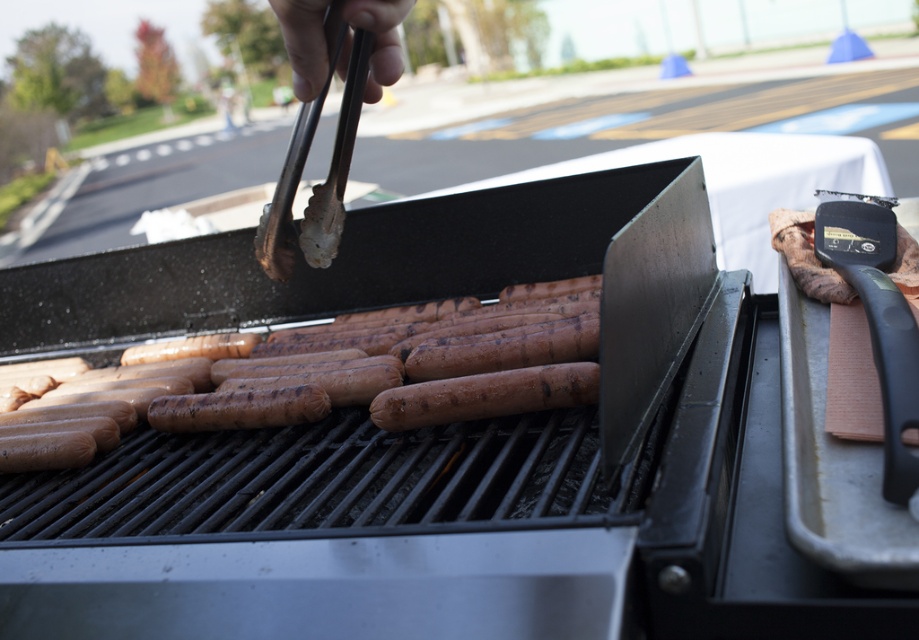
Question: Which object is the farthest from the brown matte hot dog at center?

Choices:
 (A) black plastic spatula at right
 (B) stainless steel tongs at upper center

Answer: (A)

Question: Where is black plastic spatula at right located in relation to stainless steel tongs at upper center in the image?

Choices:
 (A) below
 (B) above

Answer: (A)

Question: Estimate the real-world distances between objects in this image. Which object is closer to the black plastic spatula at right?

Choices:
 (A) brown matte hot dog at center
 (B) stainless steel tongs at upper center

Answer: (A)

Question: Is brown matte hot dog at center smaller than stainless steel tongs at upper center?

Choices:
 (A) yes
 (B) no

Answer: (B)

Question: Among these points, which one is farthest from the camera?

Choices:
 (A) (447, 353)
 (B) (307, 218)
 (C) (895, 445)

Answer: (A)

Question: Can you confirm if brown matte hot dog at center is positioned below stainless steel tongs at upper center?

Choices:
 (A) no
 (B) yes

Answer: (B)